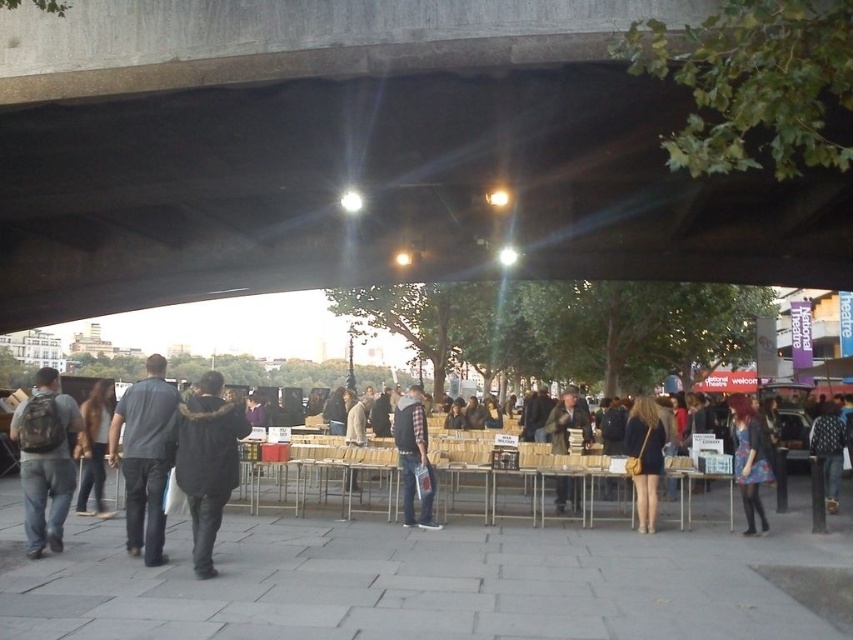
Question: Does dark brown leather jacket at left lie behind brown leather jacket at center?

Choices:
 (A) no
 (B) yes

Answer: (A)

Question: Which point is closer to the camera taking this photo?

Choices:
 (A) (422, 460)
 (B) (834, 513)
 (C) (662, 436)

Answer: (A)

Question: Estimate the real-world distances between objects in this image. Which object is closer to the matte black backpack at left?

Choices:
 (A) plaid shirt at center
 (B) floral dress at center
 (C) brown leather jacket at center

Answer: (A)

Question: Which object appears closest to the camera in this image?

Choices:
 (A) brown leather jacket at center
 (B) dark gray shirt at center
 (C) dark brown fur-lined coat at center
 (D) dark brown leather jacket at left

Answer: (C)

Question: Is matte black backpack at left above brown leather jacket at center?

Choices:
 (A) no
 (B) yes

Answer: (B)

Question: Is dark gray shirt at center bigger than dark brown fur-lined coat at center?

Choices:
 (A) no
 (B) yes

Answer: (B)